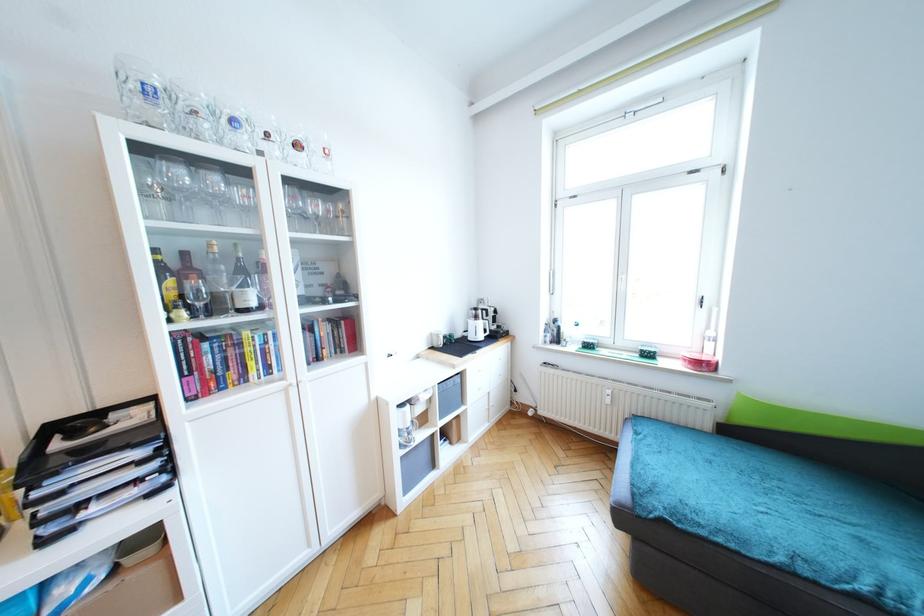
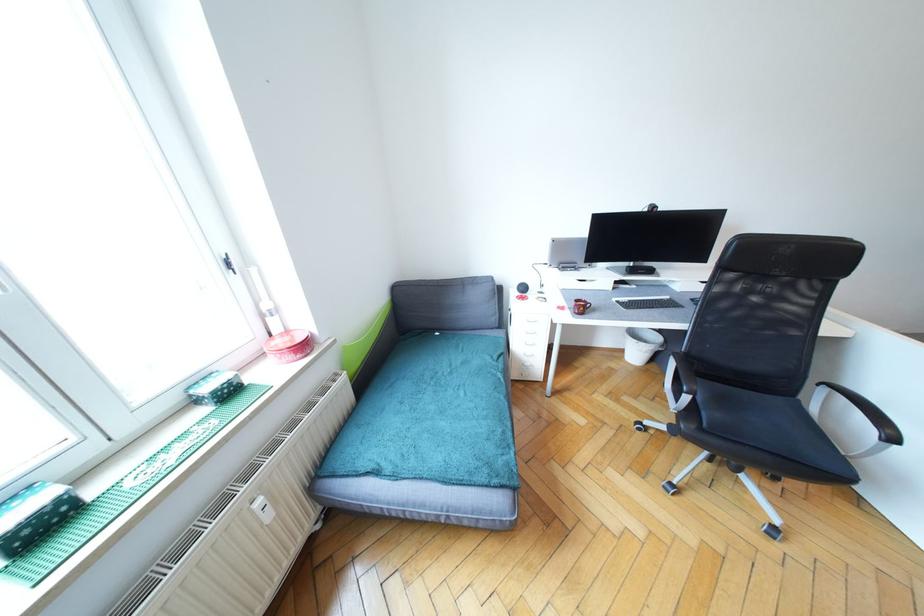
Where in the second image is the point corresponding to the point at 611,402 from the first image?

(272, 517)